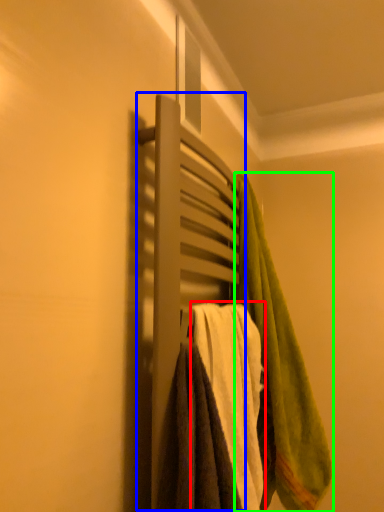
Question: Considering the real-world distances, which object is farthest from towel (highlighted by a red box)? closet (highlighted by a blue box) or towel (highlighted by a green box)?

Choices:
 (A) closet
 (B) towel

Answer: (A)